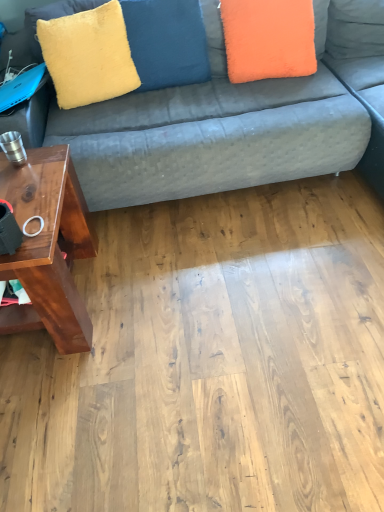
What are the coordinates of `free space in front of brown wood table at left` in the screenshot? It's located at (69, 409).